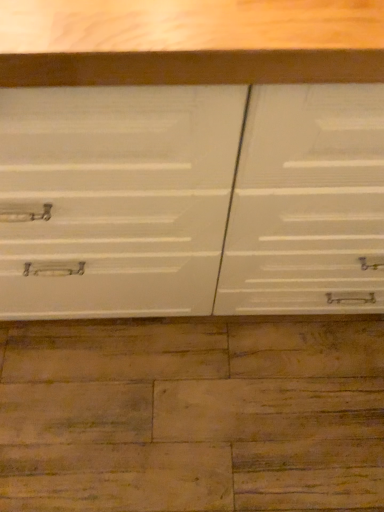
Question: Should I look upward or downward to see white matte cabinet at center?

Choices:
 (A) down
 (B) up

Answer: (B)